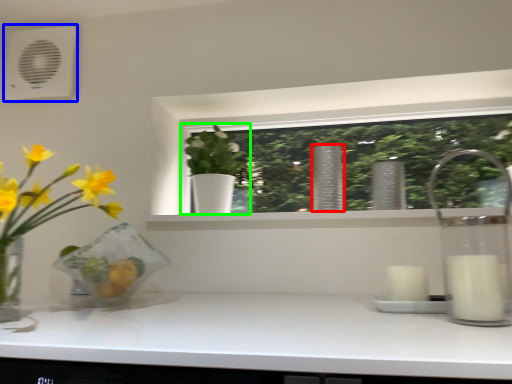
Question: Which object is positioned closest to vase (highlighted by a red box)? Select from air conditioning (highlighted by a blue box) and houseplant (highlighted by a green box).

Choices:
 (A) air conditioning
 (B) houseplant

Answer: (B)